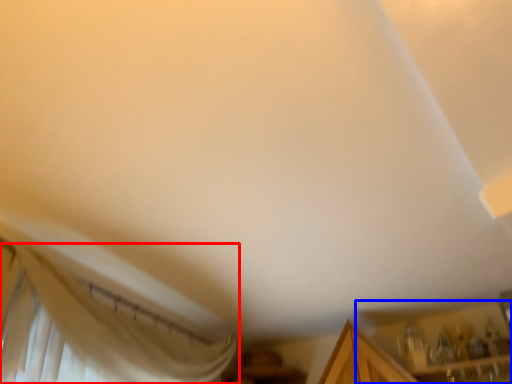
Question: Which of the following is the closest to the observer, curtain (highlighted by a red box) or cabinetry (highlighted by a blue box)?

Choices:
 (A) curtain
 (B) cabinetry

Answer: (A)